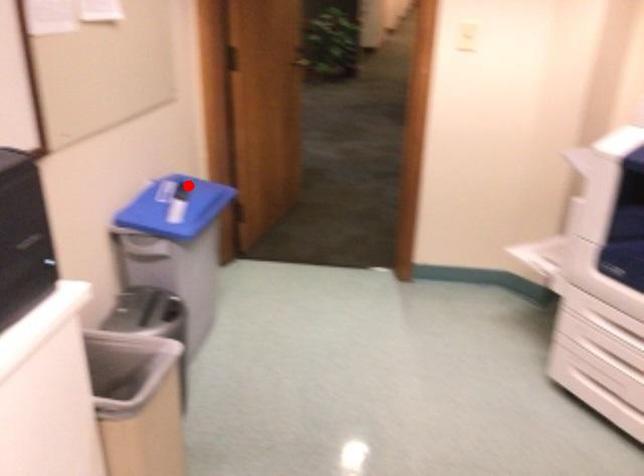
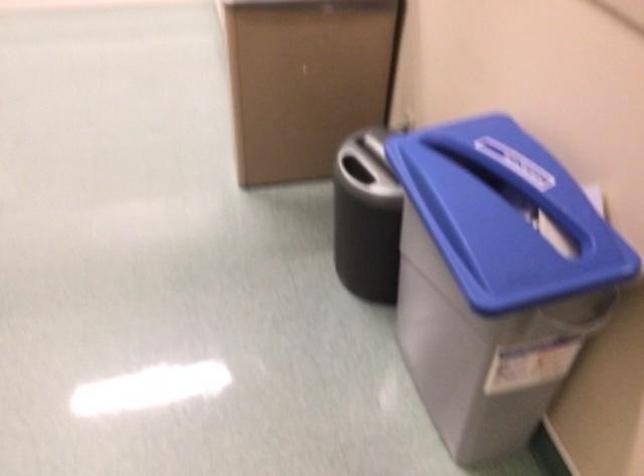
Question: I am providing you with two images of the same scene from different viewpoints. In image1, a red point is highlighted. Considering the same 3D point in image2, which of the following is correct?

Choices:
 (A) It is closer
 (B) It is farther

Answer: (A)